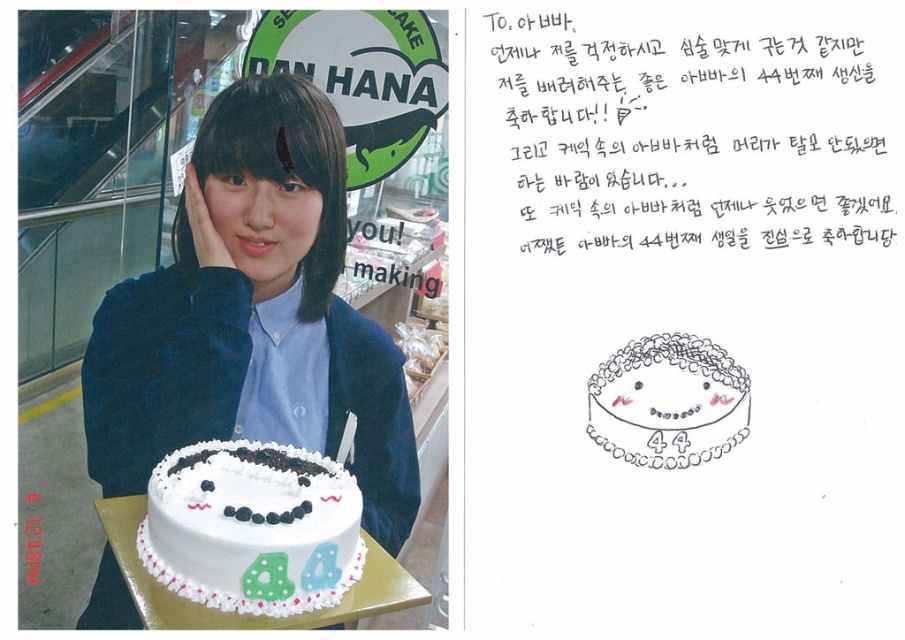
You are a customer in the bakery and want to place your order. The cake you want is at position 0.825, 0.280. Can you describe where exactly the white frosted cake with chocolate decorations at lower center is located in the photograph?

The white frosted cake with chocolate decorations at lower center is located at the 2D coordinates point (252, 528) in the photograph.

Looking at the photograph on the left side of the image, you notice the matte blue shirt at center and the white frosted cake at center. Which object is positioned higher in the image?

The matte blue shirt at center is above the white frosted cake at center, so it is positioned higher in the image.

You are at a bakery and see two cakes in the photograph. The first is a white frosted cake with chocolate decorations at lower center, and the second is a white frosted cake at center. Which cake is wider?

The white frosted cake with chocolate decorations at lower center might be wider than the white frosted cake at center.